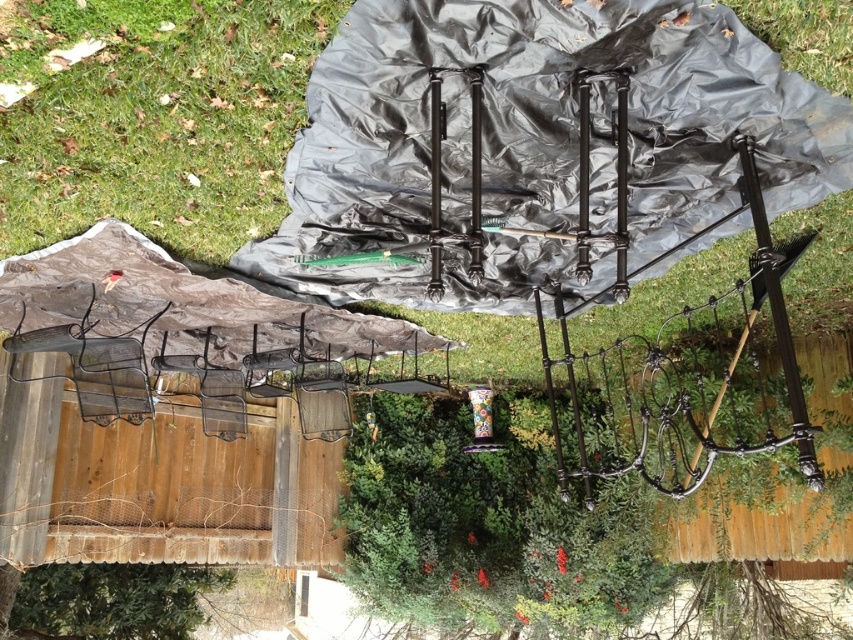
You are a gardener who wants to move the black plastic blanket at center to the green grass at upper left. Which direction should you move it to place it there?

The black plastic blanket at center is currently on the right side of green grass at upper left, so you should move it to the left to place it there.

You are standing in the outdoor area looking at the scene. Which object is located lower in the image, the black plastic blanket at center or the green grass at upper left?

The black plastic blanket at center is located lower than the green grass at upper left in the image.

You are trying to cover a picnic basket with the black plastic blanket at center. The picnic basket is placed on the green grass at upper left. Can the blanket cover the entire basket without needing to stretch it?

The black plastic blanket at center is wider than the green grass at upper left, so it should be large enough to cover the picnic basket placed on the green grass at upper left without needing to stretch it.